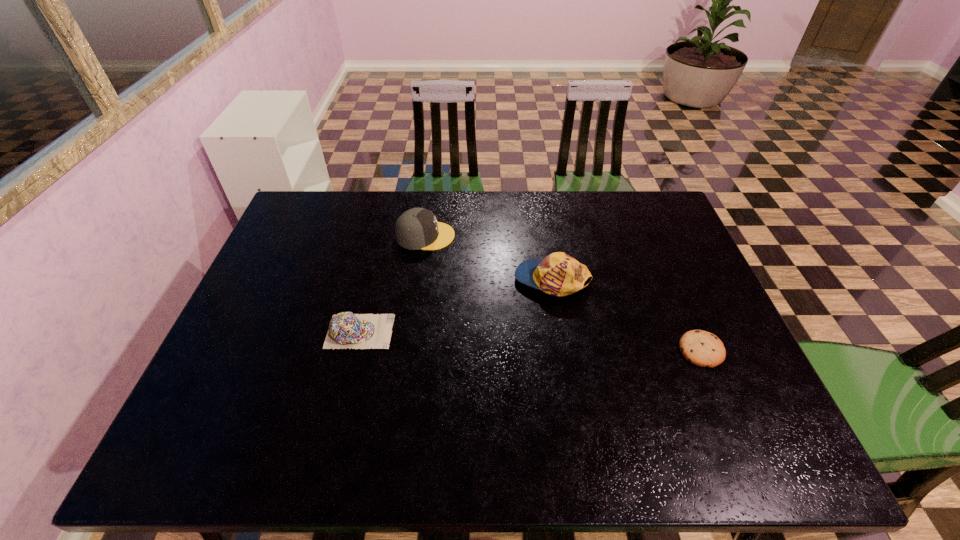
This screenshot has height=540, width=960. Identify the location of the rightmost cap. [558, 274].

This screenshot has width=960, height=540. What are the coordinates of `the third nearest object` in the screenshot? It's located at (558, 274).

The height and width of the screenshot is (540, 960). Identify the location of the farthest cap. (417, 228).

Where is `the second shortest object`? The image size is (960, 540). the second shortest object is located at coordinates (346, 330).

Locate an element on the screen. The image size is (960, 540). the shortest cap is located at coordinates (346, 330).

Locate an element on the screen. This screenshot has height=540, width=960. the shortest object is located at coordinates (x=701, y=348).

This screenshot has height=540, width=960. Identify the location of cookie. (701, 348).

Where is `vacant region located on the bill of the rightmost cap`? This screenshot has width=960, height=540. vacant region located on the bill of the rightmost cap is located at coordinates (377, 280).

Where is `vacant region located on the bill of the rightmost cap`? The image size is (960, 540). vacant region located on the bill of the rightmost cap is located at coordinates (458, 280).

Where is `free space located on the bill of the rightmost cap`? free space located on the bill of the rightmost cap is located at coordinates (416, 280).